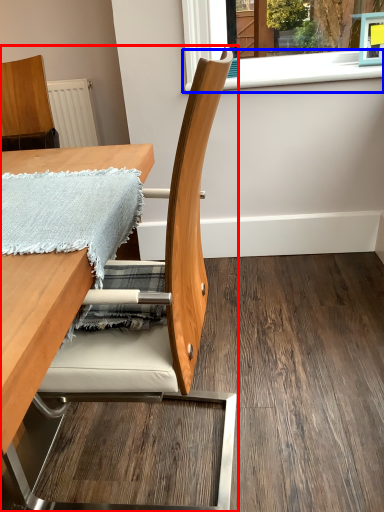
Question: Which object appears closest to the camera in this image, chair (highlighted by a red box) or window sill (highlighted by a blue box)?

Choices:
 (A) chair
 (B) window sill

Answer: (A)